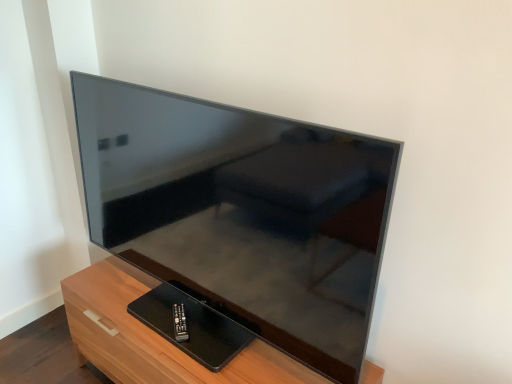
The width and height of the screenshot is (512, 384). In order to click on free space in front of black plastic remote at lower center in this screenshot , I will do `click(181, 354)`.